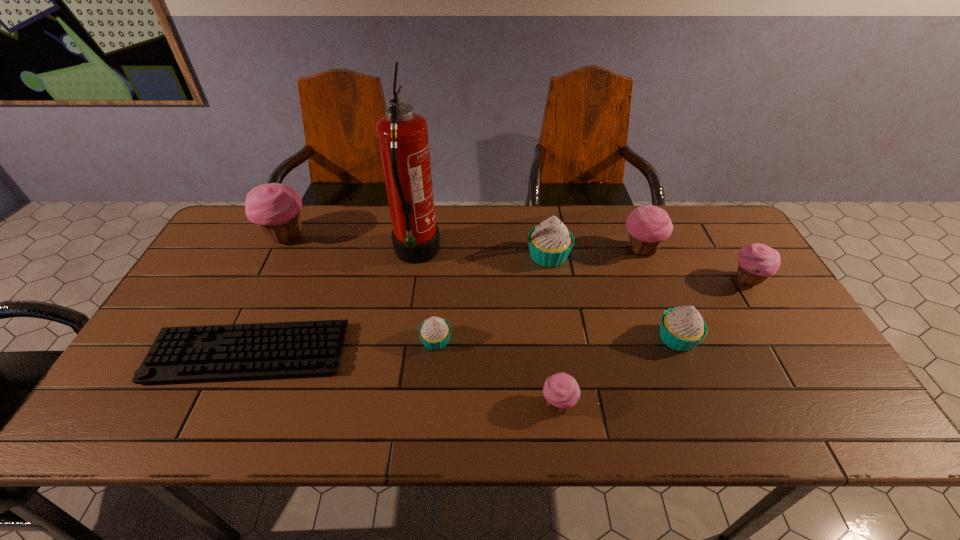
Locate an element on the screen. Image resolution: width=960 pixels, height=540 pixels. free space between the second pink cupcake from right to left and the second white cupcake from left to right is located at coordinates (594, 253).

Locate an element on the screen. This screenshot has height=540, width=960. vacant space that's between the shortest object and the farthest white cupcake is located at coordinates (398, 305).

This screenshot has width=960, height=540. Find the location of `vacant space that is in between the nearest object and the shortest object`. vacant space that is in between the nearest object and the shortest object is located at coordinates (403, 379).

Locate an element on the screen. The height and width of the screenshot is (540, 960). vacant area that lies between the red fire extinguisher and the rightmost pink cupcake is located at coordinates (582, 267).

Where is `free space between the nearest pink cupcake and the red fire extinguisher`? The height and width of the screenshot is (540, 960). free space between the nearest pink cupcake and the red fire extinguisher is located at coordinates (488, 329).

In order to click on the closest object to the second white cupcake from left to right in this screenshot , I will do `click(648, 225)`.

Identify the location of the fourth closest object to the leftmost cupcake. This screenshot has height=540, width=960. point(550,243).

You are a GUI agent. You are given a task and a screenshot of the screen. Output one action in this format:
    pyautogui.click(x=<x>, y=<y>)
    Task: Click on the cupcake that is the second closest to the leftmost pink cupcake
    
    Given the screenshot: What is the action you would take?
    pyautogui.click(x=550, y=243)

Locate which cupcake ranks third in proximity to the second biggest pink cupcake. Please provide its 2D coordinates. Your answer should be formatted as a tuple, i.e. [(x, y)], where the tuple contains the x and y coordinates of a point satisfying the conditions above.

[(682, 328)]

Locate an element on the screen. The height and width of the screenshot is (540, 960). pink cupcake identified as the closest to the nearest pink cupcake is located at coordinates (648, 225).